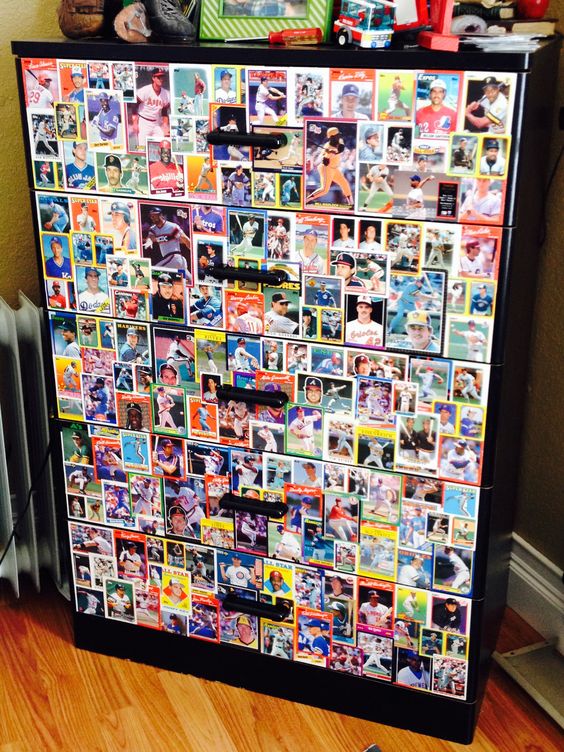
Locate an element on the screen. This screenshot has width=564, height=752. wall is located at coordinates (5, 29).